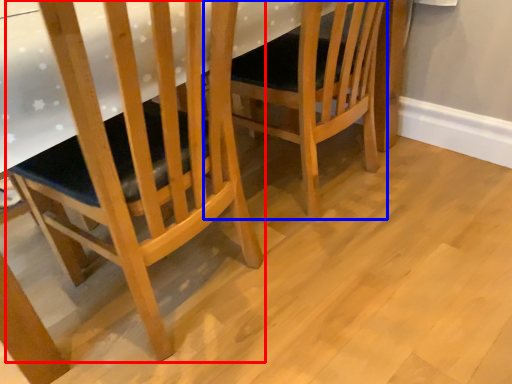
Question: Which object appears closest to the camera in this image, chair (highlighted by a red box) or chair (highlighted by a blue box)?

Choices:
 (A) chair
 (B) chair

Answer: (A)